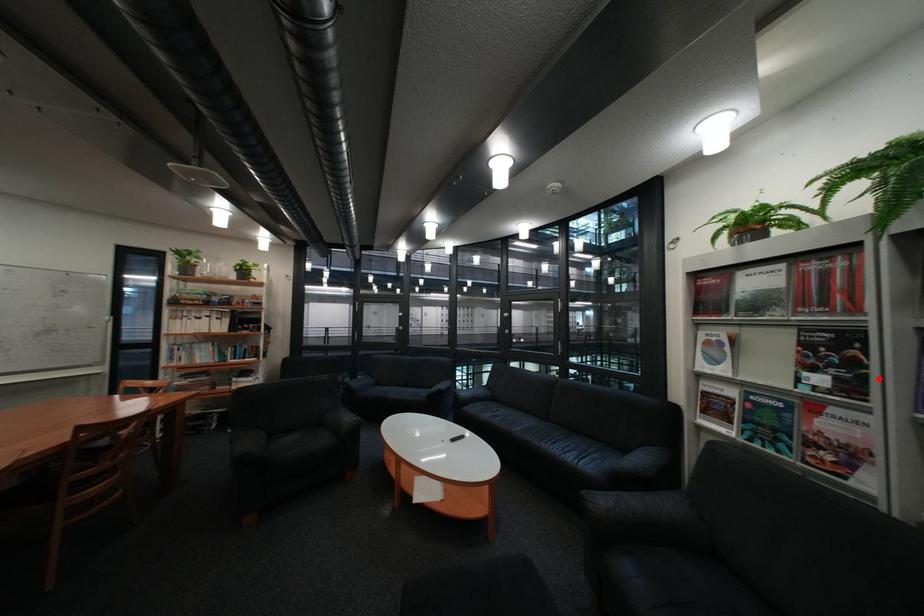
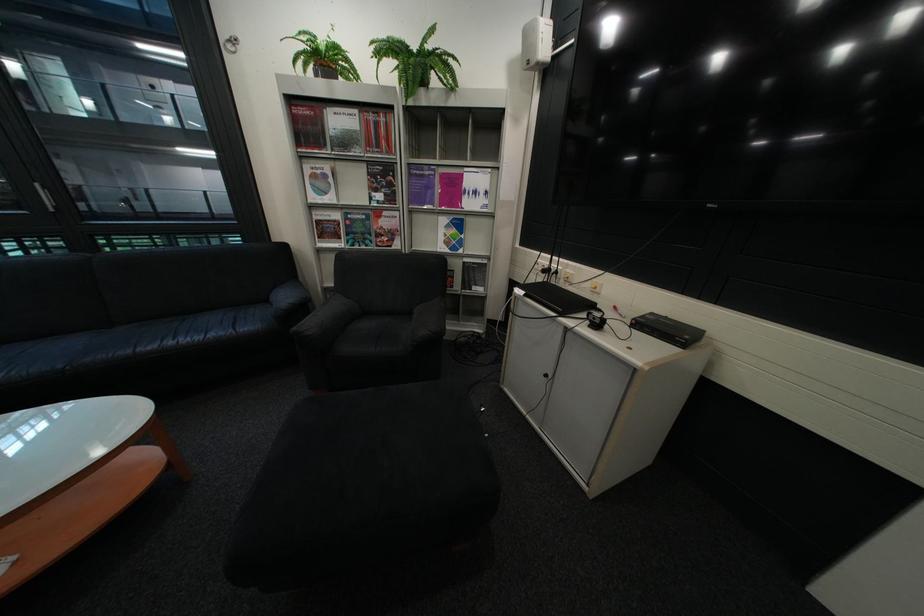
Question: I am providing you with two images of the same scene from different viewpoints. A red point is shown in image1. For the corresponding object point in image2, is it positioned nearer or farther from the camera?

Choices:
 (A) Nearer
 (B) Farther

Answer: (A)